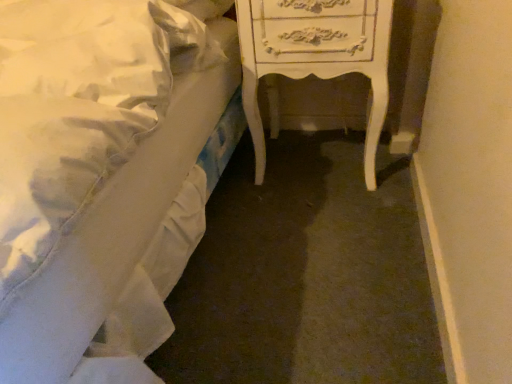
Measure the distance between point [268,28] and camera.

1.09 meters.

The width and height of the screenshot is (512, 384). What do you see at coordinates (315, 55) in the screenshot?
I see `white glossy nightstand at center` at bounding box center [315, 55].

This screenshot has width=512, height=384. I want to click on white glossy nightstand at center, so click(x=315, y=55).

Where is `white glossy nightstand at center`? white glossy nightstand at center is located at coordinates (315, 55).